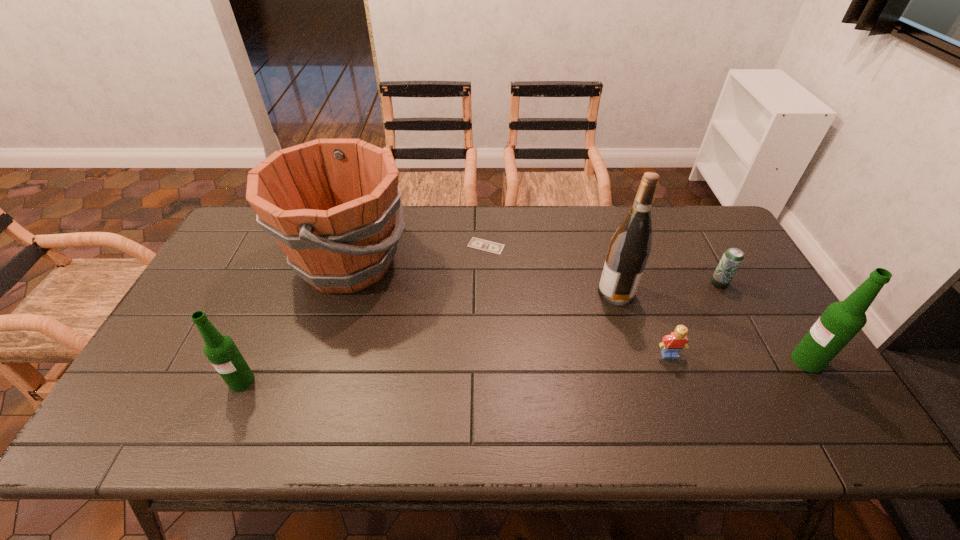
Locate an element on the screen. The height and width of the screenshot is (540, 960). the fourth shortest object is located at coordinates (221, 351).

Identify the location of the left beer bottle. This screenshot has height=540, width=960. pyautogui.click(x=221, y=351).

At what (x,y) coordinates should I click in order to perform the action: click on the rightmost object. Please return your answer as a coordinate pair (x, y). Looking at the image, I should click on point(841,321).

This screenshot has height=540, width=960. I want to click on the taller beer bottle, so click(841, 321).

Identify the location of bucket. The height and width of the screenshot is (540, 960). (331, 204).

What are the coordinates of `wine bottle` in the screenshot? It's located at (629, 249).

Locate an element on the screen. This screenshot has height=540, width=960. the fourth object from right to left is located at coordinates (629, 249).

Locate an element on the screen. The width and height of the screenshot is (960, 540). the second object from right to left is located at coordinates (732, 258).

This screenshot has width=960, height=540. What are the coordinates of `the third object from right to left` in the screenshot? It's located at (672, 344).

Identify the location of money. The height and width of the screenshot is (540, 960). (476, 243).